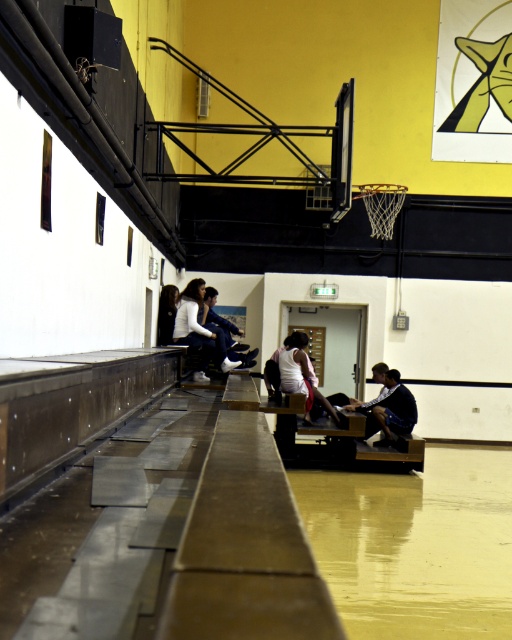
You are a photographer setting up a shoot in the basketball court. You have two items to place on the bleachers for the photo shoot. The items are a white fabric jacket at center and a dark blue jersey at center. Which item should you choose if you want to place an object that takes up less horizontal space on the bleachers?

The white fabric jacket at center is thinner than the dark blue jersey at center, so you should choose the white fabric jacket at center as it takes up less horizontal space.

You are a photographer standing at the back of the bleachers. You want to take a photo of both the dark blue uniform at center and the dark blue jersey at center so that both are clearly visible in the frame. Which object should you focus on first to ensure both are in focus?

You should focus on the dark blue uniform at center first because it is larger in size compared to the dark blue jersey at center, ensuring it will be in focus while the smaller jersey may still be within the depth of field.

You are a photographer standing at the edge of the basketball court. You want to take a photo of the dark blue jersey at center and dark blue jeans at center so that both are in focus. Given that your camera can only focus on objects within a 2 meter range, will both subjects be in focus?

The dark blue jersey at center and dark blue jeans at center are 2.51 meters apart, which exceeds the camera focus range of 2 meters. Therefore, both subjects cannot be in focus simultaneously.